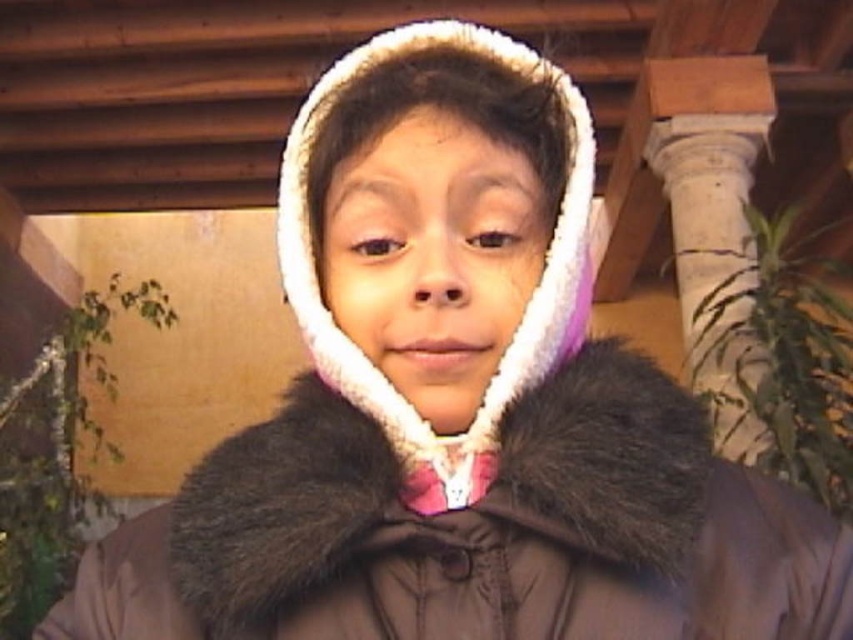
Based on the photo, can you confirm if white fur at center is positioned to the right of white stone column at upper right?

No, white fur at center is not to the right of white stone column at upper right.

Does white fur at center have a lesser height compared to white stone column at upper right?

Correct, white fur at center is not as tall as white stone column at upper right.

Locate an element on the screen. The height and width of the screenshot is (640, 853). white fur at center is located at coordinates (433, 256).